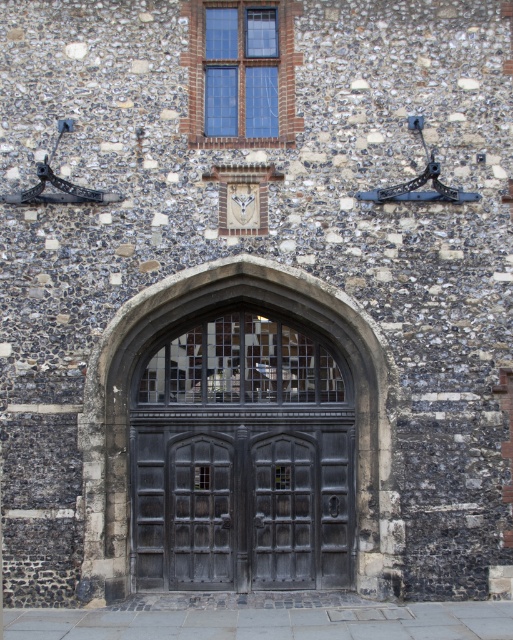
Does dark gray stone archway at center have a greater width compared to dark wood door at center?

Indeed, dark gray stone archway at center has a greater width compared to dark wood door at center.

Which is in front, point (323, 284) or point (231, 557)?

Positioned in front is point (323, 284).

You are a GUI agent. You are given a task and a screenshot of the screen. Output one action in this format:
    pyautogui.click(x=<x>, y=<y>)
    Task: Click on the dark gray stone archway at center
    This screenshot has width=513, height=640.
    Given the screenshot: What is the action you would take?
    pyautogui.click(x=240, y=440)

Is dark gray stone archway at center shorter than clear glass window at upper center?

Incorrect, dark gray stone archway at center's height does not fall short of clear glass window at upper center's.

Between point (156, 515) and point (275, 33), which one is positioned behind?

The point (275, 33) is more distant.

You are a GUI agent. You are given a task and a screenshot of the screen. Output one action in this format:
    pyautogui.click(x=<x>, y=<y>)
    Task: Click on the dark gray stone archway at center
    
    Given the screenshot: What is the action you would take?
    pyautogui.click(x=240, y=440)

From the picture: Who is positioned more to the left, dark wood door at center or clear glass window at upper center?

From the viewer's perspective, dark wood door at center appears more on the left side.

Which is in front, point (176, 544) or point (234, 80)?

Point (176, 544) is in front.

Where is `dark wood door at center`? Image resolution: width=513 pixels, height=640 pixels. dark wood door at center is located at coordinates (202, 509).